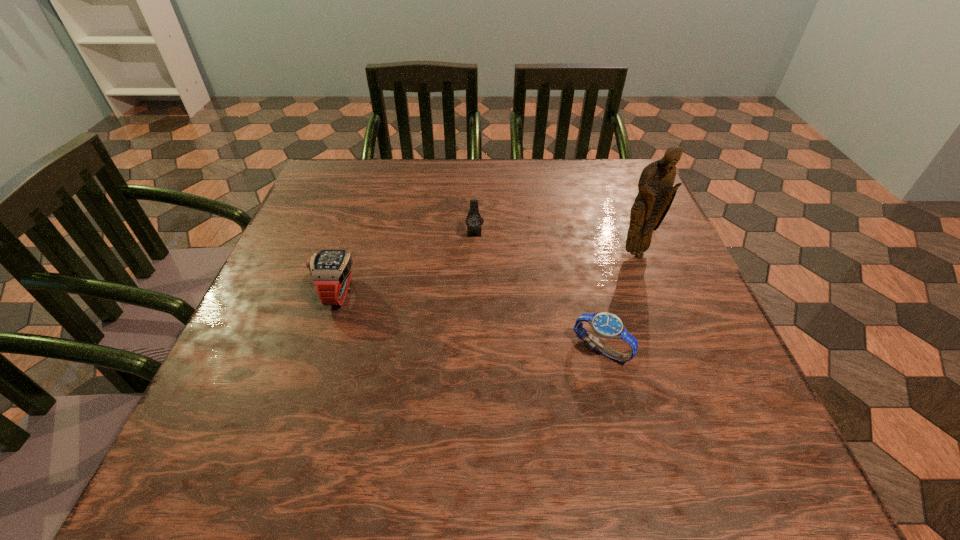
At what (x,y) coordinates should I click in order to perform the action: click on free location located 0.130m on the face of the third object from right to left. Please return your answer as a coordinate pair (x, y). Looking at the image, I should click on (474, 282).

Where is `blank space located 0.060m on the front of the nearest object`? The width and height of the screenshot is (960, 540). blank space located 0.060m on the front of the nearest object is located at coordinates (613, 401).

Locate an element on the screen. This screenshot has height=540, width=960. object that is at the left edge is located at coordinates (331, 269).

The height and width of the screenshot is (540, 960). What are the coordinates of `object that is at the right edge` in the screenshot? It's located at (656, 193).

Where is `vacant region at the far edge of the desktop`? The width and height of the screenshot is (960, 540). vacant region at the far edge of the desktop is located at coordinates (557, 158).

The width and height of the screenshot is (960, 540). Find the location of `free spot at the near edge of the desktop`. free spot at the near edge of the desktop is located at coordinates (544, 453).

Where is `vacant space at the left edge of the desktop`? This screenshot has width=960, height=540. vacant space at the left edge of the desktop is located at coordinates pos(256,307).

You are a GUI agent. You are given a task and a screenshot of the screen. Output one action in this format:
    pyautogui.click(x=<x>, y=<y>)
    Task: Click on the blank space at the right edge of the desktop
    The height and width of the screenshot is (540, 960).
    Given the screenshot: What is the action you would take?
    pyautogui.click(x=700, y=329)

At what (x,y) coordinates should I click in order to perform the action: click on vacant space at the far left corner of the desktop. Please return your answer as a coordinate pair (x, y). Looking at the image, I should click on (308, 202).

The height and width of the screenshot is (540, 960). What are the coordinates of `vacant region at the near left corner` in the screenshot? It's located at (201, 470).